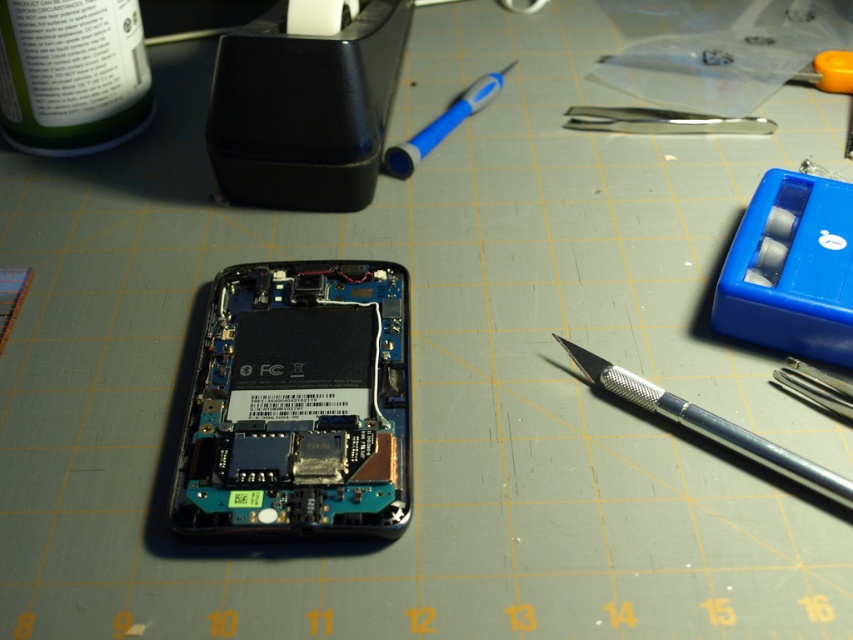
Question: Which of these objects is positioned farthest from the blue plastic pen at upper center?

Choices:
 (A) silver metallic knife at right
 (B) green matte bottle at upper left

Answer: (A)

Question: Considering the relative positions of silver metallic knife at right and blue plastic pen at upper center in the image provided, where is silver metallic knife at right located with respect to blue plastic pen at upper center?

Choices:
 (A) below
 (B) above

Answer: (A)

Question: Does green matte bottle at upper left come behind blue plastic pen at upper center?

Choices:
 (A) no
 (B) yes

Answer: (A)

Question: Does silver metallic knife at right have a larger size compared to blue plastic pen at upper center?

Choices:
 (A) yes
 (B) no

Answer: (B)

Question: Which of the following is the farthest from the observer?

Choices:
 (A) (796, 472)
 (B) (421, 156)
 (C) (28, 38)

Answer: (B)

Question: Among these points, which one is nearest to the camera?

Choices:
 (A) (16, 24)
 (B) (409, 150)

Answer: (A)